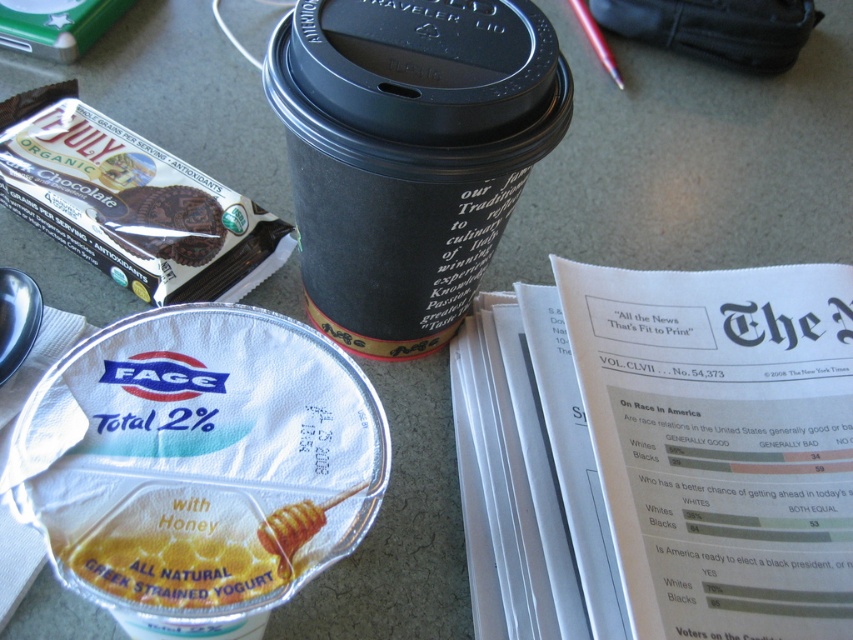
The height and width of the screenshot is (640, 853). What do you see at coordinates (408, 154) in the screenshot?
I see `black paper cup at upper center` at bounding box center [408, 154].

Who is lower down, black paper cup at upper center or metallic red pen at upper center?

Positioned lower is black paper cup at upper center.

Image resolution: width=853 pixels, height=640 pixels. I want to click on black paper cup at upper center, so click(408, 154).

Does black paper cup at upper center have a lesser height compared to chocolate wafer at upper left?

In fact, black paper cup at upper center may be taller than chocolate wafer at upper left.

Does black paper cup at upper center have a greater height compared to chocolate wafer at upper left?

Yes.

This screenshot has width=853, height=640. Find the location of `black paper cup at upper center`. black paper cup at upper center is located at coordinates (408, 154).

I want to click on black paper cup at upper center, so click(408, 154).

Can you confirm if chocolate wafer at upper left is smaller than metallic red pen at upper center?

Correct, chocolate wafer at upper left occupies less space than metallic red pen at upper center.

Between chocolate wafer at upper left and metallic red pen at upper center, which one has more height?

Standing taller between the two is metallic red pen at upper center.

Does point (117, 195) lie in front of point (614, 64)?

Yes, it is.

This screenshot has height=640, width=853. Identify the location of chocolate wafer at upper left. (166, 224).